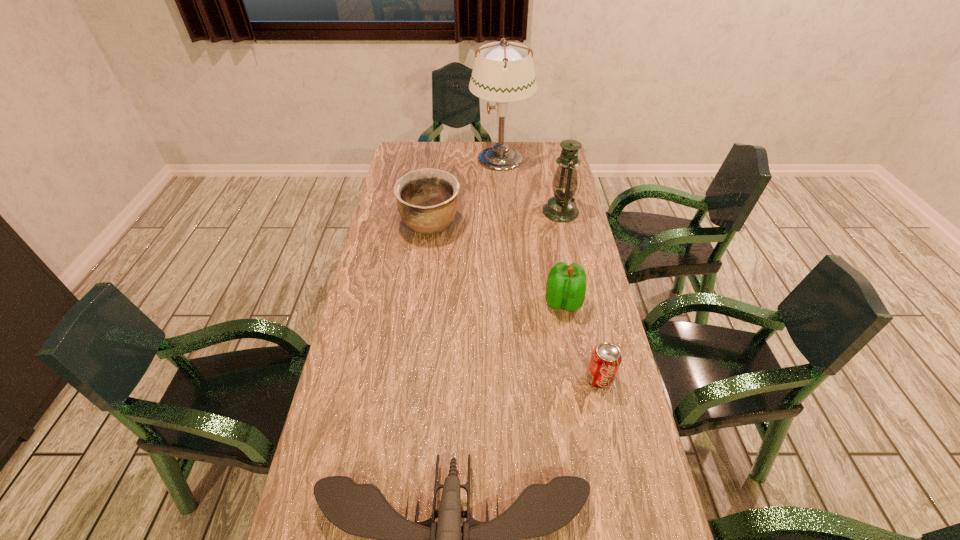
In order to click on object at the far right corner in this screenshot , I will do `click(503, 72)`.

This screenshot has width=960, height=540. In the image, there is a desktop. Find the location of `vacant space at the far edge`. vacant space at the far edge is located at coordinates (454, 154).

In the image, there is a desktop. Identify the location of vacant space at the left edge. The width and height of the screenshot is (960, 540). (351, 435).

The image size is (960, 540). I want to click on free location at the right edge of the desktop, so click(x=646, y=460).

Locate an element on the screen. vacant space at the far left corner of the desktop is located at coordinates (427, 149).

You are a GUI agent. You are given a task and a screenshot of the screen. Output one action in this format:
    pyautogui.click(x=<x>, y=<y>)
    Task: Click on the free space at the far right corner of the desktop
    This screenshot has width=960, height=540.
    Given the screenshot: What is the action you would take?
    pyautogui.click(x=559, y=153)

Find the location of `free point between the lampshade and the fifth shortest object`. free point between the lampshade and the fifth shortest object is located at coordinates (531, 185).

In order to click on free space between the farthest object and the third nearest object in this screenshot , I will do click(x=532, y=230).

Locate an element on the screen. This screenshot has height=540, width=960. unoccupied position between the pottery and the oil lamp is located at coordinates (495, 218).

Choose which object is the nearest neighbor to the second tallest object. Please provide its 2D coordinates. Your answer should be formatted as a tuple, i.e. [(x, y)], where the tuple contains the x and y coordinates of a point satisfying the conditions above.

[(503, 72)]